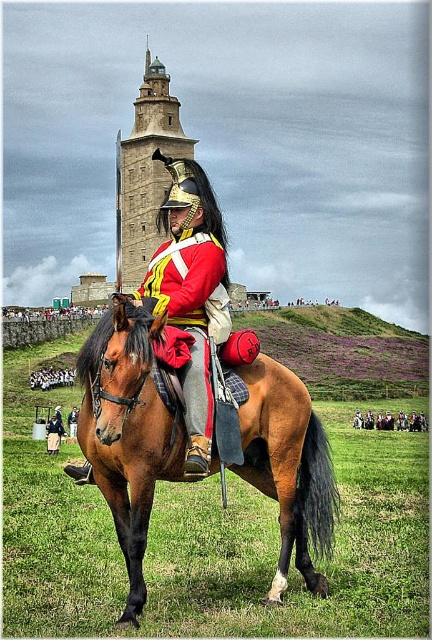
Question: Which is nearer to the brown glossy horse at center?

Choices:
 (A) shiny red uniform at center
 (B) red woolen coat at center
 (C) shiny red coat at center
 (D) red wool coat at center

Answer: (D)

Question: Does shiny red uniform at center appear under red woolen coat at center?

Choices:
 (A) yes
 (B) no

Answer: (B)

Question: Is shiny red uniform at center positioned in front of red woolen coat at center?

Choices:
 (A) no
 (B) yes

Answer: (B)

Question: Considering the real-world distances, which object is farthest from the shiny red uniform at center?

Choices:
 (A) red wool coat at center
 (B) stone tower at upper center

Answer: (B)

Question: Can you confirm if red wool coat at center is smaller than shiny red coat at center?

Choices:
 (A) yes
 (B) no

Answer: (B)

Question: Which point is farther to the camera?

Choices:
 (A) shiny red uniform at center
 (B) stone tower at upper center
 (C) brown glossy horse at center

Answer: (B)